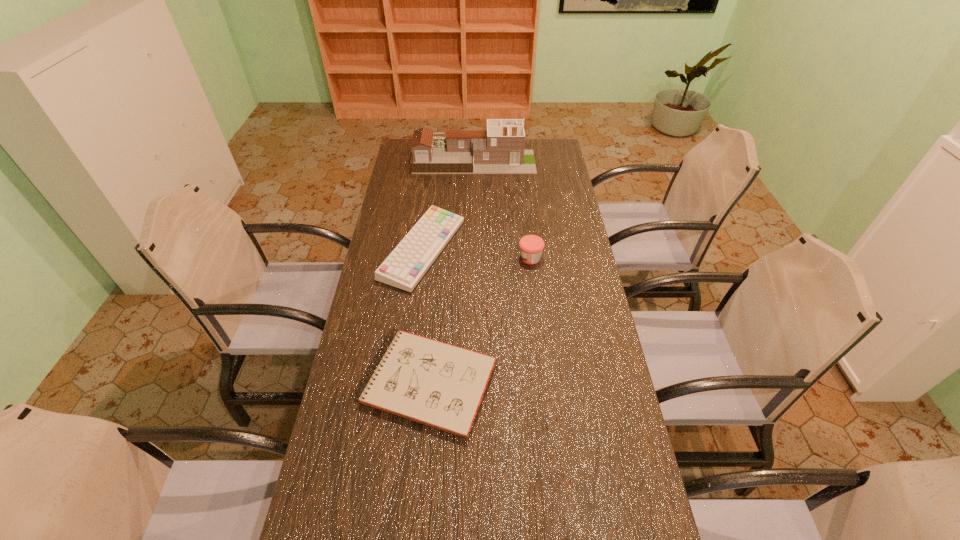
Find the location of a particular element. This screenshot has height=540, width=960. vacant position located 0.290m on the back of the third tallest object is located at coordinates pyautogui.click(x=433, y=174).

Identify the location of vacant space situated 0.100m on the front of the nearest object. The image size is (960, 540). (418, 482).

Where is `object that is at the far edge`? object that is at the far edge is located at coordinates (500, 150).

Image resolution: width=960 pixels, height=540 pixels. What are the coordinates of `dollhouse at the left edge` in the screenshot? It's located at 500,150.

This screenshot has width=960, height=540. What are the coordinates of `computer keyboard present at the left edge` in the screenshot? It's located at (405, 266).

At what (x,y) coordinates should I click in order to perform the action: click on notepad present at the left edge. Please return your answer as a coordinate pair (x, y). This screenshot has width=960, height=540. Looking at the image, I should click on (440, 385).

This screenshot has height=540, width=960. Find the location of `dollhouse at the right edge`. dollhouse at the right edge is located at coordinates (500, 150).

This screenshot has width=960, height=540. Identify the location of jam situated at the right edge. (531, 246).

This screenshot has height=540, width=960. What are the coordinates of `object that is at the far left corner` in the screenshot? It's located at [500, 150].

Where is `object present at the far right corner`? object present at the far right corner is located at coordinates (500, 150).